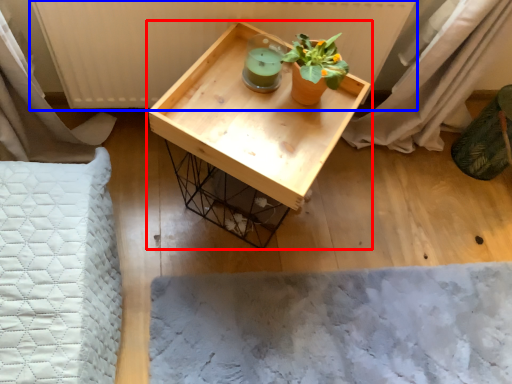
Question: Which object is closer to the camera taking this photo, table (highlighted by a red box) or radiator (highlighted by a blue box)?

Choices:
 (A) table
 (B) radiator

Answer: (A)